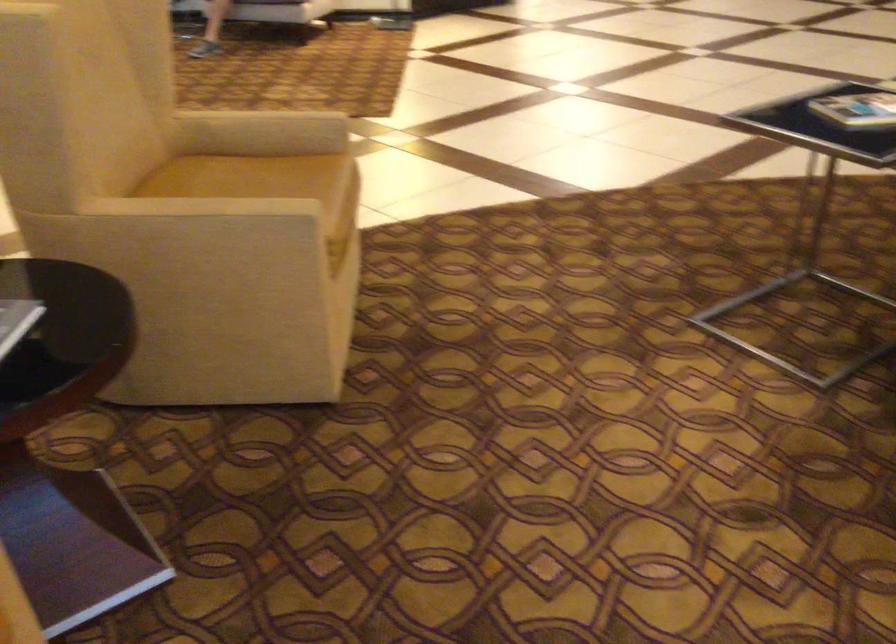
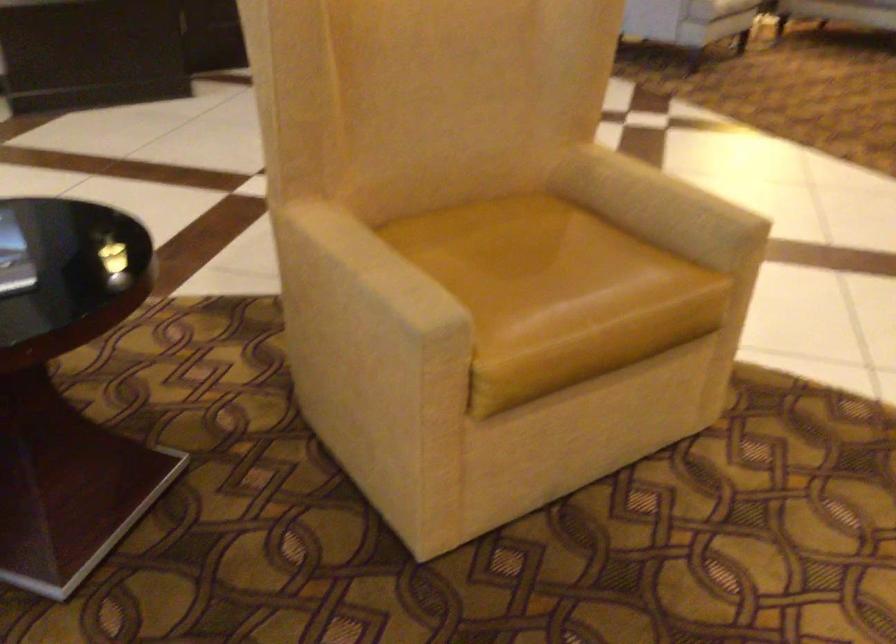
Locate, in the second image, the point that corresponds to the point at 222,207 in the first image.

(375, 266)